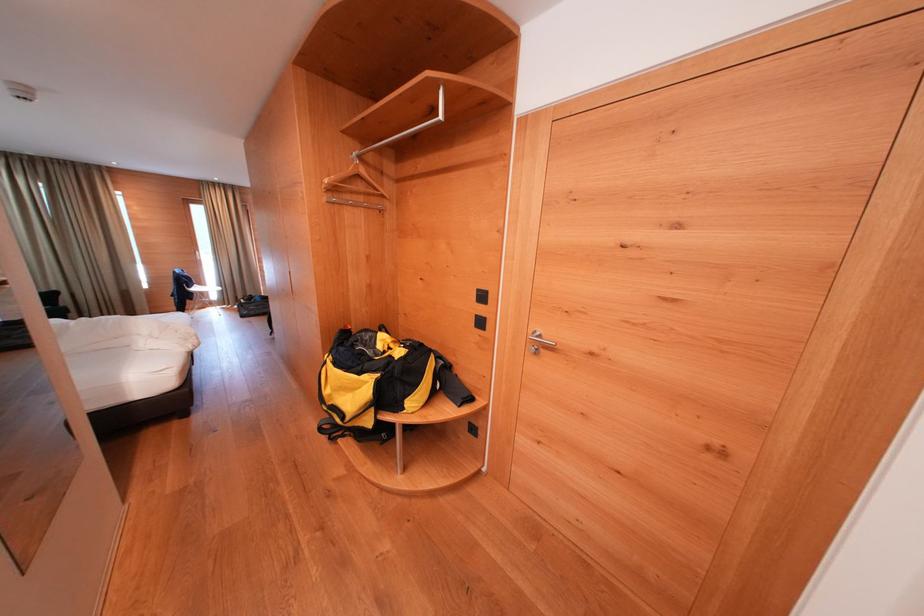
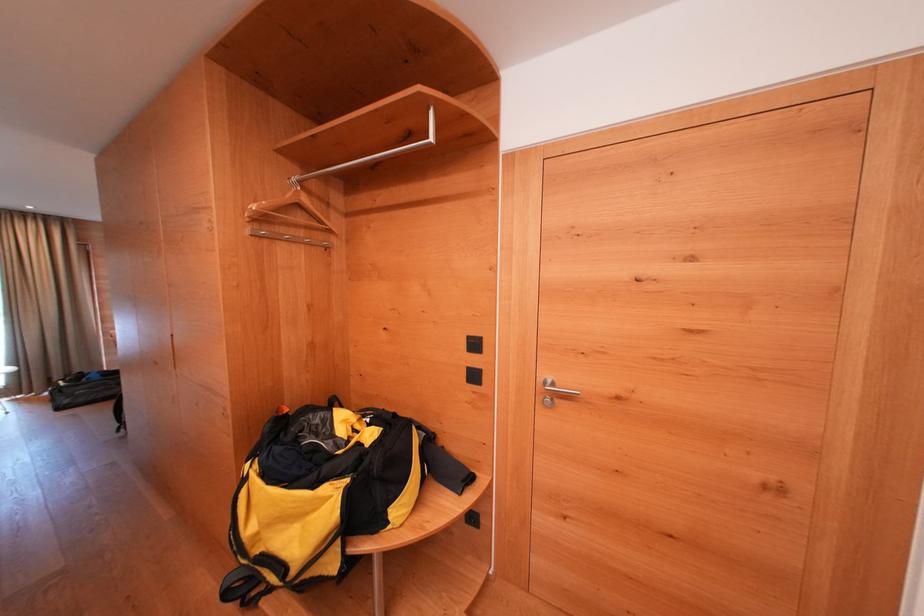
Find the pixel in the second image that matches [490,301] in the first image.

(481, 349)